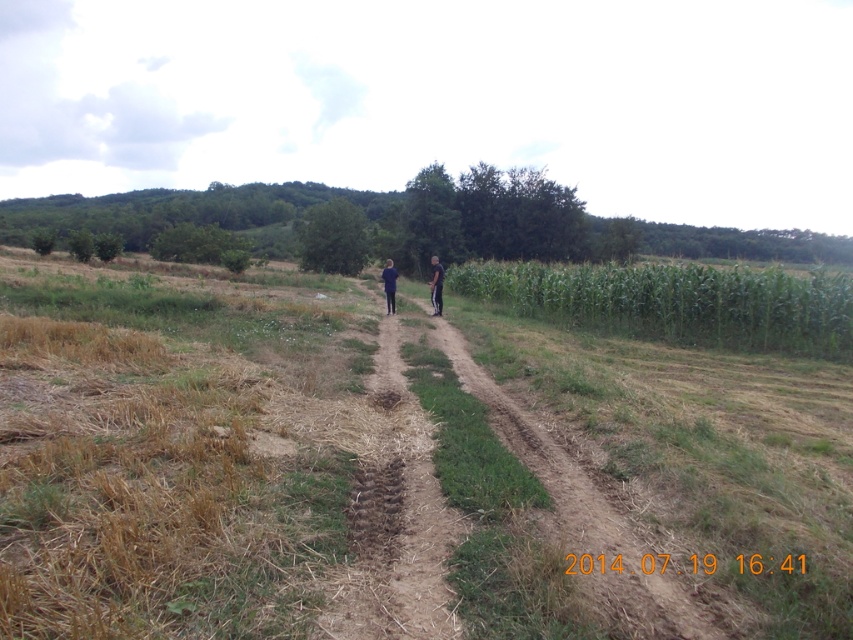
Question: Can you confirm if brown dirt trail at center is positioned to the left of blue fabric shirt at center?

Choices:
 (A) no
 (B) yes

Answer: (A)

Question: Which object is positioned closest to the black matte pants at center?

Choices:
 (A) green leafy hill at upper center
 (B) blue fabric shirt at center
 (C) green leafy corn at right

Answer: (B)

Question: Which of these objects is positioned closest to the brown dirt trail at center?

Choices:
 (A) blue fabric shirt at center
 (B) green grassy at center
 (C) green leafy hill at upper center
 (D) blue fabric couple at center

Answer: (B)

Question: Is green leafy corn at right further to camera compared to black matte pants at center?

Choices:
 (A) yes
 (B) no

Answer: (B)

Question: Does blue fabric couple at center have a lesser width compared to blue fabric shirt at center?

Choices:
 (A) yes
 (B) no

Answer: (B)

Question: Which object appears farthest from the camera in this image?

Choices:
 (A) blue fabric shirt at center
 (B) green leafy hill at upper center
 (C) brown dirt trail at center
 (D) green grassy at center

Answer: (B)